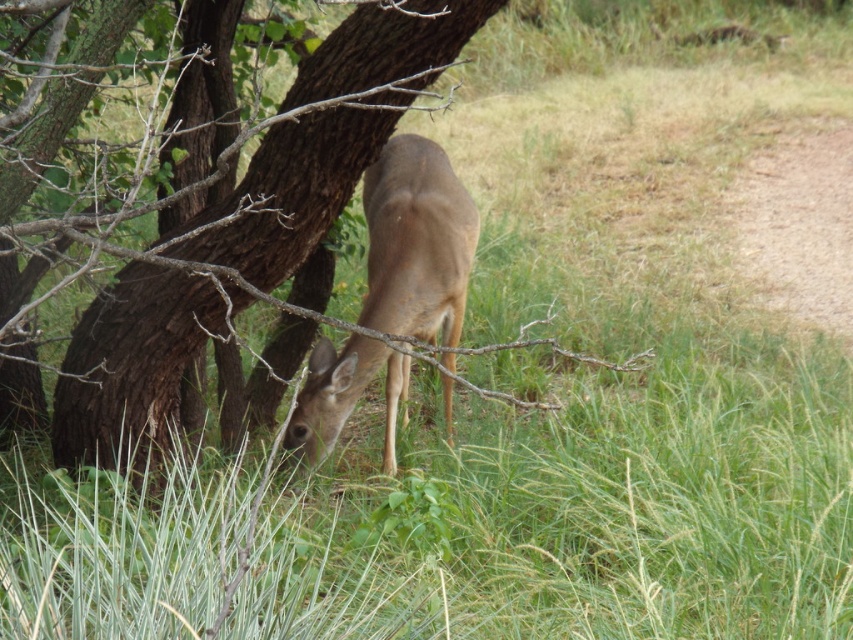
You are a hiker who wants to take a photo of the deer without disturbing it. You have a camera with a zoom lens. There is a brown rough bark tree at center at point [131,362]. Can you use the tree to hide behind while taking the photo?

Yes, you can hide behind the brown rough bark tree at center at point [131,362] to take the photo without disturbing the deer.